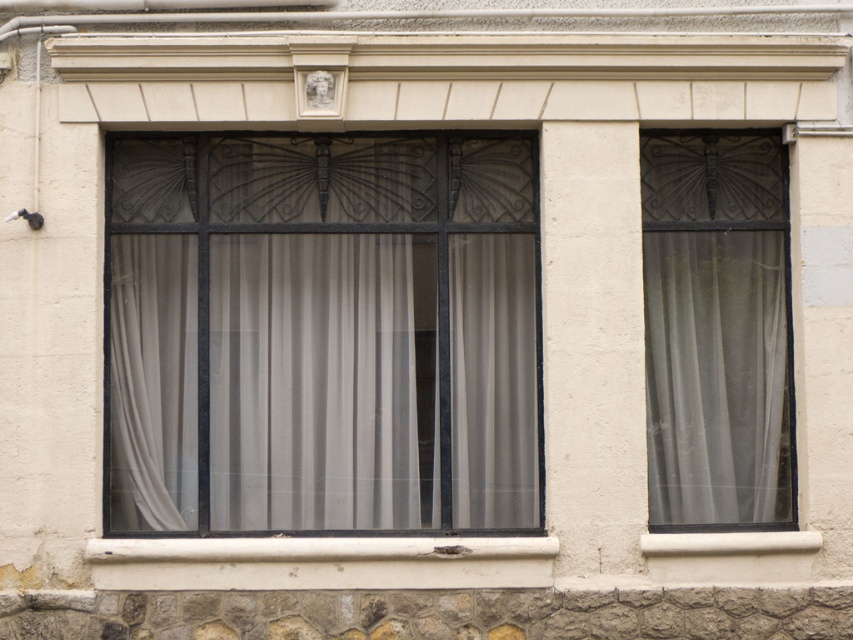
Question: Where is translucent fabric window at center located in relation to matte glass window at right in the image?

Choices:
 (A) right
 (B) left

Answer: (B)

Question: Which object is farther from the camera taking this photo?

Choices:
 (A) matte glass window at right
 (B) translucent fabric window at center

Answer: (B)

Question: Is translucent fabric window at center smaller than matte glass window at right?

Choices:
 (A) no
 (B) yes

Answer: (A)

Question: Can you confirm if translucent fabric window at center is positioned to the right of matte glass window at right?

Choices:
 (A) yes
 (B) no

Answer: (B)